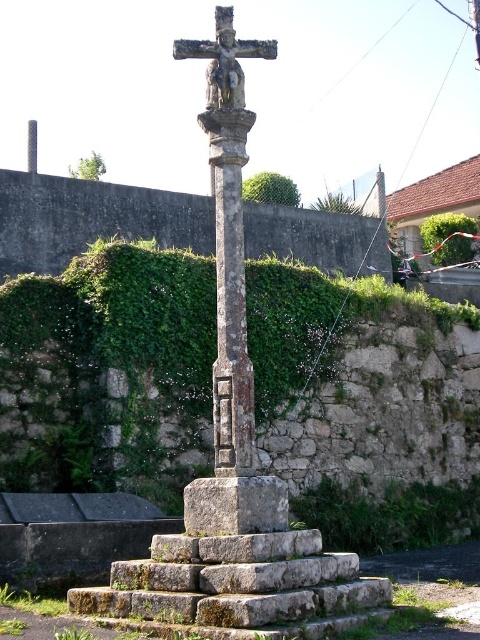
You are standing in front of the stone cross monument and want to take a photo. There are two points marked on the monument, one at point (244, 138) and the other at point (183, 524). Which point will appear larger in your photo?

Point (244, 138) will appear larger in the photo because it is closer to the camera than point (183, 524).

You are a historian examining the stone cross monument. You notice the rusty stone cross at center and the rusty stone column at center. Which object is located higher in the image?

The rusty stone cross at center is positioned over the rusty stone column at center, so it is higher.